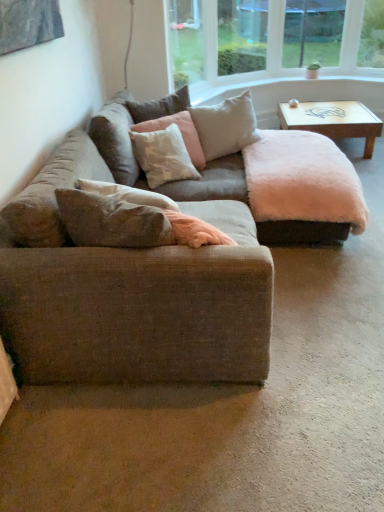
Question: Are soft beige cushion at upper center, marked as the first pillow in a back-to-front arrangement, and textured beige couch at center making contact?

Choices:
 (A) yes
 (B) no

Answer: (B)

Question: Would you say textured beige couch at center is part of soft beige cushion at upper center, marked as the first pillow in a back-to-front arrangement,'s contents?

Choices:
 (A) no
 (B) yes

Answer: (A)

Question: Can we say soft beige cushion at upper center, marked as the first pillow in a back-to-front arrangement, lies outside textured beige couch at center?

Choices:
 (A) yes
 (B) no

Answer: (A)

Question: Is soft beige cushion at upper center, marked as the first pillow in a back-to-front arrangement, bigger than textured beige couch at center?

Choices:
 (A) yes
 (B) no

Answer: (B)

Question: From the image's perspective, is soft beige cushion at upper center, marked as the first pillow in a back-to-front arrangement, above textured beige couch at center?

Choices:
 (A) no
 (B) yes

Answer: (B)

Question: From the image's perspective, is wooden coffee table at upper right above or below textured beige couch at center?

Choices:
 (A) below
 (B) above

Answer: (B)

Question: In terms of width, does wooden coffee table at upper right look wider or thinner when compared to textured beige couch at center?

Choices:
 (A) thin
 (B) wide

Answer: (A)

Question: In the image, is wooden coffee table at upper right positioned in front of or behind textured beige couch at center?

Choices:
 (A) behind
 (B) front

Answer: (A)

Question: Considering the positions of wooden coffee table at upper right and textured beige couch at center in the image, is wooden coffee table at upper right bigger or smaller than textured beige couch at center?

Choices:
 (A) small
 (B) big

Answer: (A)

Question: Would you say soft pink fabric pillow at center, positioned as the 2th pillow in front-to-back order, is inside or outside textured beige couch at center?

Choices:
 (A) inside
 (B) outside

Answer: (B)

Question: Looking at their shapes, would you say soft pink fabric pillow at center, positioned as the 2th pillow in front-to-back order, is wider or thinner than textured beige couch at center?

Choices:
 (A) thin
 (B) wide

Answer: (A)

Question: Is soft pink fabric pillow at center, positioned as the 2th pillow in front-to-back order, taller or shorter than textured beige couch at center?

Choices:
 (A) short
 (B) tall

Answer: (A)

Question: From a real-world perspective, relative to textured beige couch at center, is soft pink fabric pillow at center, positioned as the 2th pillow in front-to-back order, vertically above or below?

Choices:
 (A) below
 (B) above

Answer: (B)

Question: Considering the relative positions of clear glass window screen at upper center, arranged as the 2th window screen when viewed from the left, and light beige fabric pillow at center, the 3th pillow viewed from the front, in the image provided, is clear glass window screen at upper center, arranged as the 2th window screen when viewed from the left, to the left or to the right of light beige fabric pillow at center, the 3th pillow viewed from the front,?

Choices:
 (A) right
 (B) left

Answer: (A)

Question: Is clear glass window screen at upper center, the 1th window screen positioned from the right, taller or shorter than light beige fabric pillow at center, which ranks as the 2th pillow in back-to-front order?

Choices:
 (A) short
 (B) tall

Answer: (B)